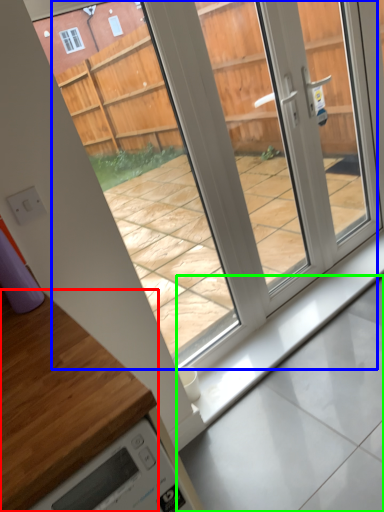
Question: Which object is positioned farthest from countertop (highlighted by a red box)? Select from glass door (highlighted by a blue box) and concrete (highlighted by a green box).

Choices:
 (A) glass door
 (B) concrete

Answer: (A)